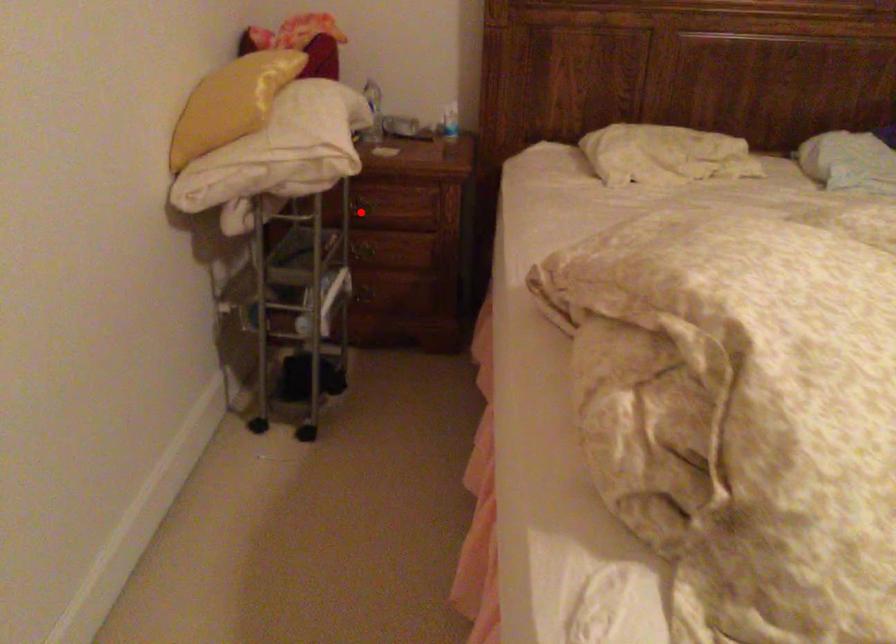
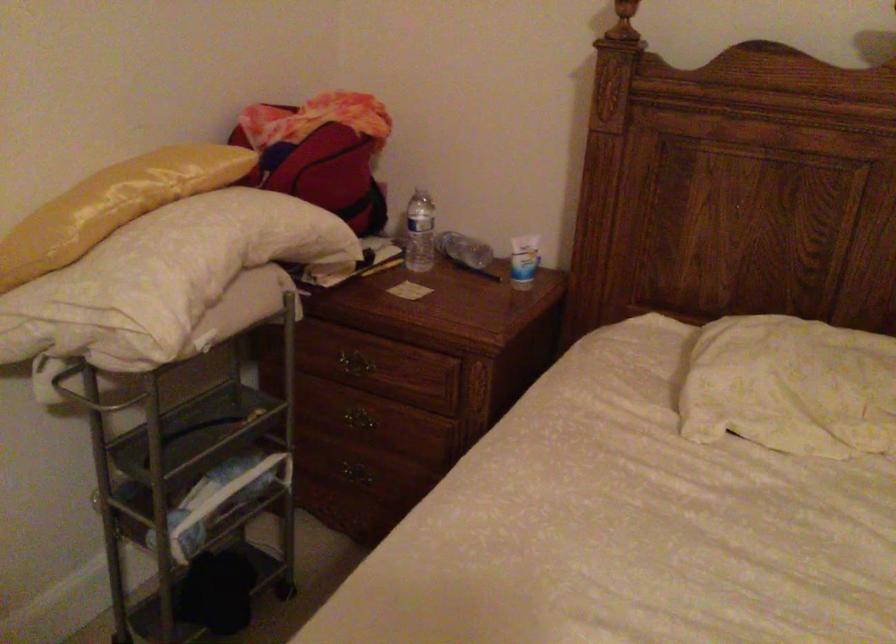
Question: A red point is marked in image1. In image2, is the corresponding 3D point closer to the camera or farther? Reply with the corresponding letter.

Choices:
 (A) The corresponding 3D point is closer.
 (B) The corresponding 3D point is farther.

Answer: (A)